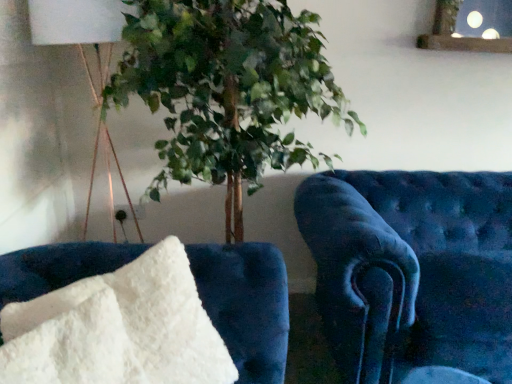
This screenshot has width=512, height=384. What do you see at coordinates (246, 304) in the screenshot? I see `white fluffy pillow at lower left, positioned as the first furniture in front-to-back order` at bounding box center [246, 304].

The width and height of the screenshot is (512, 384). Find the location of `white fluffy pillow at lower left, positioned as the first furniture in front-to-back order`. white fluffy pillow at lower left, positioned as the first furniture in front-to-back order is located at coordinates (246, 304).

Measure the distance between point (429, 258) and camera.

Point (429, 258) and camera are 5.57 feet apart.

Locate an element on the screen. Image resolution: width=512 pixels, height=384 pixels. velvet blue armchair at right, positioned as the second furniture in front-to-back order is located at coordinates (412, 270).

Image resolution: width=512 pixels, height=384 pixels. In order to click on white fluffy pillow at lower left, which is the first furniture from left to right in this screenshot , I will do `click(246, 304)`.

Can you confirm if white fluffy pillow at lower left, which is the 2th furniture in right-to-left order, is positioned to the left of white fabric lampshade at upper left?

In fact, white fluffy pillow at lower left, which is the 2th furniture in right-to-left order, is to the right of white fabric lampshade at upper left.

Is white fluffy pillow at lower left, which is the first furniture from left to right, inside or outside of white fabric lampshade at upper left?

white fluffy pillow at lower left, which is the first furniture from left to right, lies outside white fabric lampshade at upper left.

Considering the sizes of objects white fluffy pillow at lower left, which is the first furniture from left to right, and white fabric lampshade at upper left in the image provided, who is taller, white fluffy pillow at lower left, which is the first furniture from left to right, or white fabric lampshade at upper left?

With more height is white fabric lampshade at upper left.

From a real-world perspective, is velvet blue armchair at right, arranged as the second furniture when viewed from the left, positioned over white fabric lampshade at upper left based on gravity?

Incorrect, from a real-world perspective, velvet blue armchair at right, arranged as the second furniture when viewed from the left, is lower than white fabric lampshade at upper left.

You are a GUI agent. You are given a task and a screenshot of the screen. Output one action in this format:
    pyautogui.click(x=<x>, y=<y>)
    Task: Click on the table lamp located on the left of velvet blue armchair at right, placed as the 1th furniture when sorted from back to front
    
    Given the screenshot: What is the action you would take?
    pyautogui.click(x=79, y=29)

In the scene shown: Is velvet blue armchair at right, arranged as the second furniture when viewed from the left, situated inside white fabric lampshade at upper left or outside?

velvet blue armchair at right, arranged as the second furniture when viewed from the left, is spatially situated outside white fabric lampshade at upper left.

Can you see velvet blue armchair at right, placed as the 1th furniture when sorted from back to front, touching white fluffy pillow at lower left, which is the first furniture from left to right?

No, velvet blue armchair at right, placed as the 1th furniture when sorted from back to front, is not with white fluffy pillow at lower left, which is the first furniture from left to right.

Looking at this image, is velvet blue armchair at right, arranged as the second furniture when viewed from the left, positioned with its back to white fluffy pillow at lower left, positioned as the first furniture in front-to-back order?

No, velvet blue armchair at right, arranged as the second furniture when viewed from the left,'s orientation is not away from white fluffy pillow at lower left, positioned as the first furniture in front-to-back order.

Is velvet blue armchair at right, placed as the 1th furniture when sorted from back to front, further to camera compared to white fluffy pillow at lower left, which is the first furniture from left to right?

Yes, velvet blue armchair at right, placed as the 1th furniture when sorted from back to front, is behind white fluffy pillow at lower left, which is the first furniture from left to right.

At what (x,y) coordinates should I click in order to perform the action: click on furniture that is in front of the velvet blue armchair at right, the first furniture when ordered from right to left. Please return your answer as a coordinate pair (x, y). The width and height of the screenshot is (512, 384). Looking at the image, I should click on (246, 304).

Locate an element on the screen. The height and width of the screenshot is (384, 512). furniture that is under the white fluffy pillow at lower left, which is the first furniture from left to right (from a real-world perspective) is located at coordinates (412, 270).

Can you confirm if white fluffy pillow at lower left, positioned as the first furniture in front-to-back order, is positioned to the right of velvet blue armchair at right, positioned as the second furniture in front-to-back order?

No.

Are white fluffy pillow at lower left, the second furniture when ordered from back to front, and velvet blue armchair at right, arranged as the second furniture when viewed from the left, making contact?

No.

Based on the photo, is white fluffy pillow at lower left, which is the first furniture from left to right, oriented towards velvet blue armchair at right, positioned as the second furniture in front-to-back order?

No, white fluffy pillow at lower left, which is the first furniture from left to right, is not oriented towards velvet blue armchair at right, positioned as the second furniture in front-to-back order.

Is white fabric lampshade at upper left turned away from velvet blue armchair at right, positioned as the second furniture in front-to-back order?

white fabric lampshade at upper left is not turned away from velvet blue armchair at right, positioned as the second furniture in front-to-back order.

Considering the relative sizes of white fabric lampshade at upper left and velvet blue armchair at right, positioned as the second furniture in front-to-back order, in the image provided, is white fabric lampshade at upper left shorter than velvet blue armchair at right, positioned as the second furniture in front-to-back order,?

Incorrect, the height of white fabric lampshade at upper left does not fall short of that of velvet blue armchair at right, positioned as the second furniture in front-to-back order.

Considering the sizes of white fabric lampshade at upper left and velvet blue armchair at right, the first furniture when ordered from right to left, in the image, is white fabric lampshade at upper left wider or thinner than velvet blue armchair at right, the first furniture when ordered from right to left,?

white fabric lampshade at upper left is thinner than velvet blue armchair at right, the first furniture when ordered from right to left.

Is white fabric lampshade at upper left to the left of velvet blue armchair at right, the first furniture when ordered from right to left, from the viewer's perspective?

Yes.

Where is `table lamp above the white fluffy pillow at lower left, which is the first furniture from left to right (from the image's perspective)`? The width and height of the screenshot is (512, 384). table lamp above the white fluffy pillow at lower left, which is the first furniture from left to right (from the image's perspective) is located at coordinates (79, 29).

Based on their positions, is white fabric lampshade at upper left located to the left or right of white fluffy pillow at lower left, positioned as the first furniture in front-to-back order?

In the image, white fabric lampshade at upper left appears on the left side of white fluffy pillow at lower left, positioned as the first furniture in front-to-back order.

Does white fabric lampshade at upper left have a greater width compared to white fluffy pillow at lower left, which is the first furniture from left to right?

Yes, white fabric lampshade at upper left is wider than white fluffy pillow at lower left, which is the first furniture from left to right.

Is the position of white fabric lampshade at upper left less distant than that of white fluffy pillow at lower left, which is the first furniture from left to right?

No, white fabric lampshade at upper left is further to the viewer.

Where is `the 2nd furniture in front of the white fabric lampshade at upper left`? The width and height of the screenshot is (512, 384). the 2nd furniture in front of the white fabric lampshade at upper left is located at coordinates (246, 304).

Identify the location of furniture that is the 2nd object to the right of the white fabric lampshade at upper left, starting at the anchor. The image size is (512, 384). pos(412,270).

From the image, which object appears to be nearer to white fluffy pillow at lower left, the second furniture when ordered from back to front, velvet blue armchair at right, the first furniture when ordered from right to left, or white fabric lampshade at upper left?

Among the two, velvet blue armchair at right, the first furniture when ordered from right to left, is located nearer to white fluffy pillow at lower left, the second furniture when ordered from back to front.

When comparing their distances from velvet blue armchair at right, positioned as the second furniture in front-to-back order, does white fabric lampshade at upper left or white fluffy pillow at lower left, which is the first furniture from left to right, seem closer?

white fluffy pillow at lower left, which is the first furniture from left to right, is closer to velvet blue armchair at right, positioned as the second furniture in front-to-back order.

From the image, which object appears to be farther from velvet blue armchair at right, the first furniture when ordered from right to left, white fluffy pillow at lower left, which is the first furniture from left to right, or white fabric lampshade at upper left?

Based on the image, white fabric lampshade at upper left appears to be further to velvet blue armchair at right, the first furniture when ordered from right to left.

Which object lies further to the anchor point white fabric lampshade at upper left, velvet blue armchair at right, the first furniture when ordered from right to left, or white fluffy pillow at lower left, which is the first furniture from left to right?

Among the two, velvet blue armchair at right, the first furniture when ordered from right to left, is located further to white fabric lampshade at upper left.

Considering their positions, is white fabric lampshade at upper left positioned closer to white fluffy pillow at lower left, the second furniture when ordered from back to front, than velvet blue armchair at right, arranged as the second furniture when viewed from the left?

velvet blue armchair at right, arranged as the second furniture when viewed from the left.

Which object lies further to the anchor point white fabric lampshade at upper left, white fluffy pillow at lower left, which is the first furniture from left to right, or velvet blue armchair at right, placed as the 1th furniture when sorted from back to front?

velvet blue armchair at right, placed as the 1th furniture when sorted from back to front, is positioned further to the anchor white fabric lampshade at upper left.

The width and height of the screenshot is (512, 384). What are the coordinates of `furniture located between white fabric lampshade at upper left and velvet blue armchair at right, positioned as the second furniture in front-to-back order, in the left-right direction` in the screenshot? It's located at point(246,304).